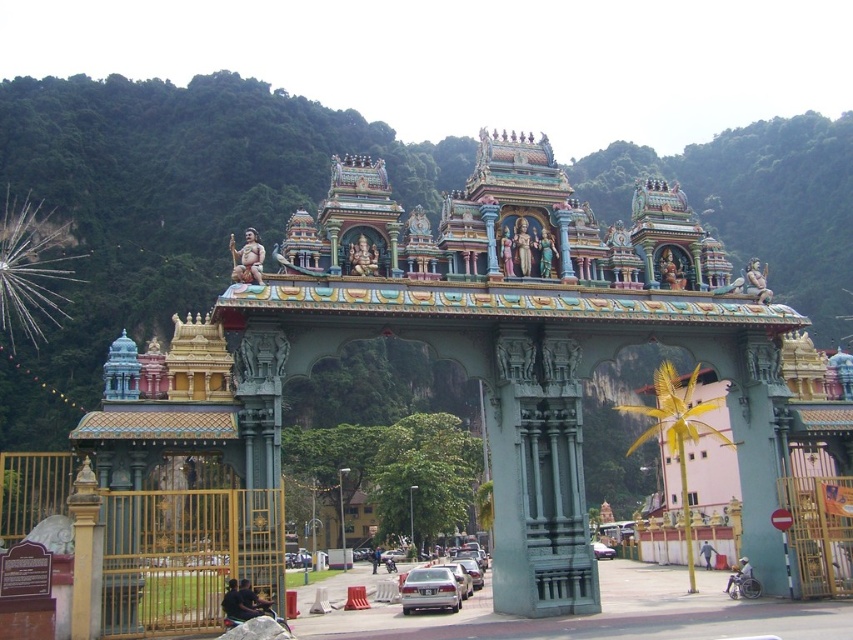
Consider the image. You are standing in front of the temple gate and want to locate the smooth golden statue at center. According to the coordinates provided, where exactly is it positioned?

The smooth golden statue at center is positioned at coordinates point (247, 259).

Consider the image. You are a photographer planning to capture the temple gate with both the polished gold statue at center and the metallic silver car at center in the frame. Based on their heights, which object should you position closer to the camera to ensure both appear proportionally sized in the photo?

The polished gold statue at center has a lesser height compared to the metallic silver car at center. To make them appear proportionally sized in the photo, position the polished gold statue at center closer to the camera since it is shorter and needs to be magnified slightly to match the apparent size of the taller metallic silver car at center.

You are a visitor at the temple gate and want to take a photo of both the smooth golden statue at center and the dark blue shirt at center. Which object should you focus on first to ensure both are in frame?

You should focus on the smooth golden statue at center first because it is taller than the dark blue shirt at center, so by centering the statue, the smaller shirt will also be included in the frame.